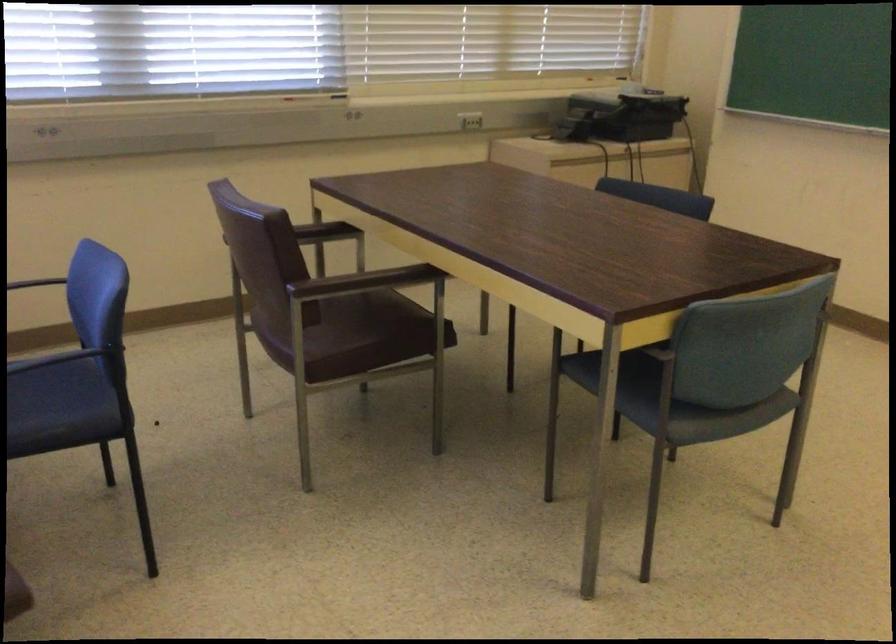
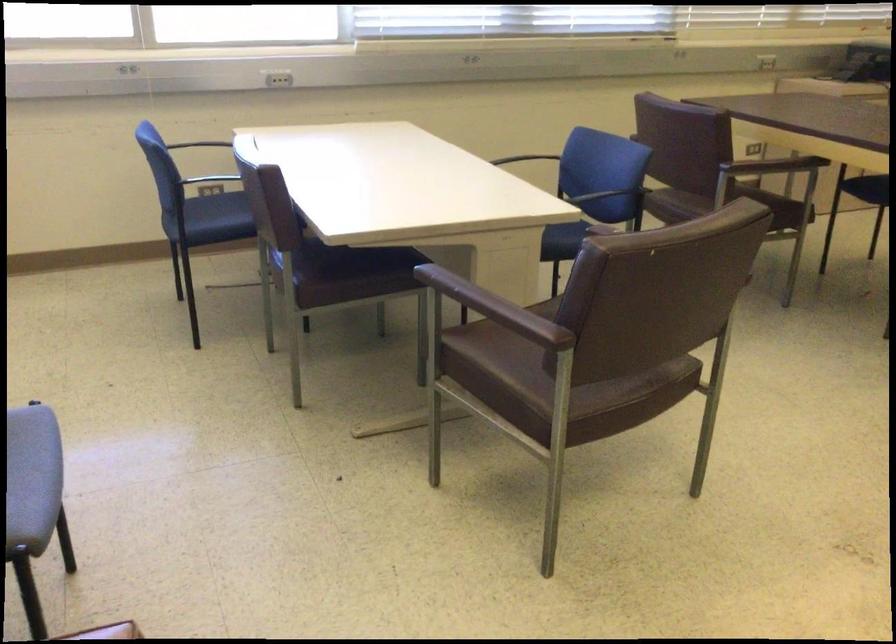
Question: I am providing you with two images of the same scene from different viewpoints. Which of the following objects are not visible in image2?

Choices:
 (A) green flip-flop
 (B) black chair armrest
 (C) brown chair armrest
 (D) blue chair sitting surface

Answer: (C)